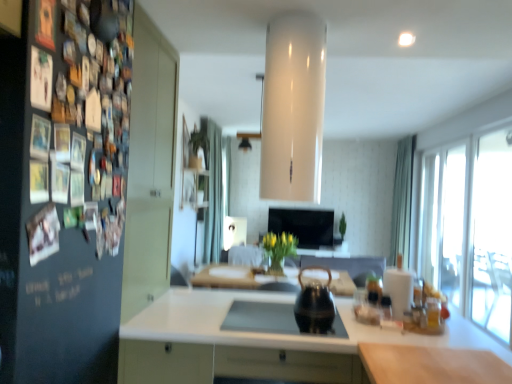
The width and height of the screenshot is (512, 384). What do you see at coordinates (276, 267) in the screenshot? I see `translucent glass vase at center` at bounding box center [276, 267].

Image resolution: width=512 pixels, height=384 pixels. Describe the element at coordinates (431, 365) in the screenshot. I see `light wood countertop at lower right, which is the second countertop in left-to-right order` at that location.

What is the approximate width of transparent glass door at right, arranged as the first glass door when viewed from the front?

It is 2.93 inches.

This screenshot has height=384, width=512. I want to click on dark matte board at left, so click(x=62, y=194).

Locate an element on the screen. green fabric curtain at right, acting as the second curtain starting from the left is located at coordinates (402, 201).

Describe the element at coordinates (279, 246) in the screenshot. I see `yellow matte vase at center` at that location.

I want to click on translucent glass vase at center, so click(276, 267).

Between green matte plant at center and translucent glass vase at center, which one has less height?

translucent glass vase at center is shorter.

Which object is wider, green matte plant at center or translucent glass vase at center?

With larger width is green matte plant at center.

Is green matte plant at center touching translucent glass vase at center?

No, green matte plant at center is not next to translucent glass vase at center.

Based on the photo, how different are the orientations of green matte plant at center and translucent glass vase at center in degrees?

The angular difference between green matte plant at center and translucent glass vase at center is 2.16 degrees.

Is dark matte board at left inside white glossy countertop at center, the second countertop positioned from the right?

That's incorrect, dark matte board at left is not inside white glossy countertop at center, the second countertop positioned from the right.

From the image's perspective, is white glossy countertop at center, the 1th countertop in the left-to-right sequence, on top of dark matte board at left?

No, from the image's perspective, white glossy countertop at center, the 1th countertop in the left-to-right sequence, is not above dark matte board at left.

Considering the sizes of white glossy countertop at center, the 1th countertop in the left-to-right sequence, and dark matte board at left in the image, is white glossy countertop at center, the 1th countertop in the left-to-right sequence, taller or shorter than dark matte board at left?

white glossy countertop at center, the 1th countertop in the left-to-right sequence, is shorter than dark matte board at left.

Which is in front, point (456, 337) or point (54, 268)?

The point (54, 268) is closer.

Can dark matte board at left be found inside green fabric curtain at center, acting as the 2th curtain starting from the right?

No, green fabric curtain at center, acting as the 2th curtain starting from the right, does not contain dark matte board at left.

From a real-world perspective, which curtain is the 1st one underneath the dark matte board at left? Please provide its 2D coordinates.

[(213, 192)]

Considering the points (221, 150) and (113, 247), which point is behind, point (221, 150) or point (113, 247)?

The point (221, 150) is behind.

Locate an element on the screen. This screenshot has width=512, height=384. bulletin board in front of the matte black tea pot at center is located at coordinates (62, 194).

Considering the sizes of objects matte black tea pot at center and dark matte board at left in the image provided, who is taller, matte black tea pot at center or dark matte board at left?

With more height is dark matte board at left.

How many degrees apart are the facing directions of matte black tea pot at center and dark matte board at left?

The angle between the facing direction of matte black tea pot at center and the facing direction of dark matte board at left is 90 degrees.

From the image's perspective, which is above, matte black tea pot at center or dark matte board at left?

From the image's view, dark matte board at left is above.

Locate an element on the screen. The image size is (512, 384). the 1st countertop below the yellow matte vase at center (from the image's perspective) is located at coordinates (431, 365).

Is light wood countertop at lower right, the second countertop viewed from the back, spatially inside yellow matte vase at center, or outside of it?

light wood countertop at lower right, the second countertop viewed from the back, is outside yellow matte vase at center.

From the image's perspective, is light wood countertop at lower right, which is the second countertop in left-to-right order, located above yellow matte vase at center?

No, from the image's perspective, light wood countertop at lower right, which is the second countertop in left-to-right order, is not over yellow matte vase at center.

Who is taller, dark matte board at left or light wood countertop at lower right, the second countertop viewed from the back?

dark matte board at left is taller.

Considering the sizes of objects dark matte board at left and light wood countertop at lower right, placed as the second countertop when sorted from bottom to top, in the image provided, who is smaller, dark matte board at left or light wood countertop at lower right, placed as the second countertop when sorted from bottom to top,?

Smaller between the two is light wood countertop at lower right, placed as the second countertop when sorted from bottom to top.

From the image's perspective, is dark matte board at left on light wood countertop at lower right, placed as the second countertop when sorted from bottom to top?

Yes, from the image's perspective, dark matte board at left is on top of light wood countertop at lower right, placed as the second countertop when sorted from bottom to top.

From a real-world perspective, is dark matte board at left physically below light wood countertop at lower right, which is the second countertop in left-to-right order?

No, from a real-world perspective, dark matte board at left is not beneath light wood countertop at lower right, which is the second countertop in left-to-right order.

From a real-world perspective, which is physically above, transparent glass door at right, marked as the second glass door in a front-to-back arrangement, or light wood countertop at lower right, the second countertop viewed from the back?

In real-world perspective, transparent glass door at right, marked as the second glass door in a front-to-back arrangement, is above.

Would you consider transparent glass door at right, marked as the second glass door in a front-to-back arrangement, to be distant from light wood countertop at lower right, the second countertop viewed from the back?

transparent glass door at right, marked as the second glass door in a front-to-back arrangement, is positioned a significant distance from light wood countertop at lower right, the second countertop viewed from the back.

Considering the relative positions of transparent glass door at right, marked as the 1th glass door in a back-to-front arrangement, and light wood countertop at lower right, the 1th countertop from the front, in the image provided, is transparent glass door at right, marked as the 1th glass door in a back-to-front arrangement, to the left of light wood countertop at lower right, the 1th countertop from the front, from the viewer's perspective?

No, transparent glass door at right, marked as the 1th glass door in a back-to-front arrangement, is not to the left of light wood countertop at lower right, the 1th countertop from the front.

You are a GUI agent. You are given a task and a screenshot of the screen. Output one action in this format:
    pyautogui.click(x=<x>, y=<y>)
    Task: Click on the plant above the translucent glass vase at center (from a real-world perspective)
    Image resolution: width=512 pixels, height=384 pixels.
    Given the screenshot: What is the action you would take?
    pyautogui.click(x=342, y=226)

Which countertop is the 2nd one when counting from the back of the dark matte board at left? Please provide its 2D coordinates.

[(257, 343)]

When comparing their distances from black glossy tv at center, does green fabric curtain at right, the first curtain in the right-to-left sequence, or white glossy countertop at center, the 1th countertop in the left-to-right sequence, seem further?

Based on the image, white glossy countertop at center, the 1th countertop in the left-to-right sequence, appears to be further to black glossy tv at center.

When comparing their distances from transparent glass door at right, marked as the 1th glass door in a back-to-front arrangement, does green matte plant at center or black glossy tv at center seem closer?

black glossy tv at center is closer to transparent glass door at right, marked as the 1th glass door in a back-to-front arrangement.

Estimate the real-world distances between objects in this image. Which object is further from yellow matte vase at center, green fabric curtain at right, the first curtain in the right-to-left sequence, or transparent glass door at right, marked as the 1th glass door in a back-to-front arrangement?

green fabric curtain at right, the first curtain in the right-to-left sequence, is further to yellow matte vase at center.

Looking at the image, which one is located further to transparent glass door at right, marked as the 1th glass door in a back-to-front arrangement, white glossy countertop at center, acting as the first countertop starting from the bottom, or light wood countertop at lower right, placed as the 1th countertop when sorted from right to left?

→ The object further to transparent glass door at right, marked as the 1th glass door in a back-to-front arrangement, is light wood countertop at lower right, placed as the 1th countertop when sorted from right to left.

When comparing their distances from translucent glass vase at center, does yellow matte vase at center or matte black tea pot at center seem closer?

yellow matte vase at center is closer to translucent glass vase at center.

Estimate the real-world distances between objects in this image. Which object is closer to white glossy countertop at center, which is counted as the first countertop, starting from the back, green fabric curtain at right, the first curtain in the right-to-left sequence, or transparent glass door at right, arranged as the first glass door when viewed from the front?

Among the two, transparent glass door at right, arranged as the first glass door when viewed from the front, is located nearer to white glossy countertop at center, which is counted as the first countertop, starting from the back.

Which object lies nearer to the anchor point green fabric curtain at center, acting as the 2th curtain starting from the right, matte black tea pot at center or green fabric curtain at right, the first curtain in the right-to-left sequence?

green fabric curtain at right, the first curtain in the right-to-left sequence.

Estimate the real-world distances between objects in this image. Which object is closer to transparent glass door at right, arranged as the first glass door when viewed from the front, matte black tea pot at center or black glossy tv at center?

Based on the image, matte black tea pot at center appears to be nearer to transparent glass door at right, arranged as the first glass door when viewed from the front.

Where is `tea pot located between light wood countertop at lower right, placed as the second countertop when sorted from bottom to top, and transparent glass door at right, arranged as the first glass door when viewed from the front, in the depth direction`? tea pot located between light wood countertop at lower right, placed as the second countertop when sorted from bottom to top, and transparent glass door at right, arranged as the first glass door when viewed from the front, in the depth direction is located at coordinates (314, 304).

Locate an element on the screen. window screen between green fabric curtain at center, acting as the 2th curtain starting from the right, and green matte plant at center from left to right is located at coordinates (303, 225).

Where is `curtain between green fabric curtain at center, which ranks as the first curtain in left-to-right order, and transparent glass door at right, marked as the second glass door in a front-to-back arrangement, from left to right`? This screenshot has width=512, height=384. curtain between green fabric curtain at center, which ranks as the first curtain in left-to-right order, and transparent glass door at right, marked as the second glass door in a front-to-back arrangement, from left to right is located at coordinates pyautogui.click(x=402, y=201).

The height and width of the screenshot is (384, 512). What are the coordinates of `sink between white glossy countertop at center, which is counted as the first countertop, starting from the back, and green matte plant at center from front to back` in the screenshot? It's located at (261, 318).